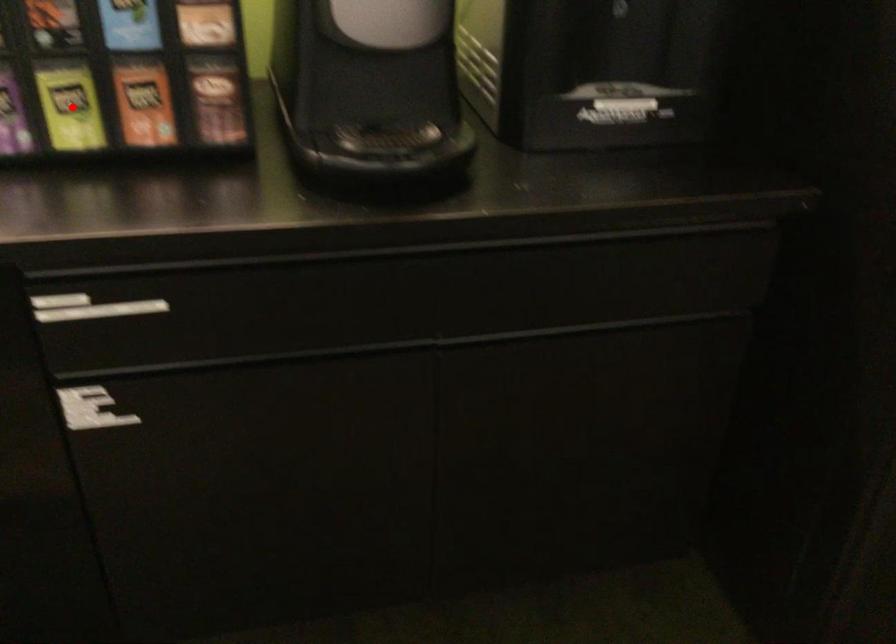
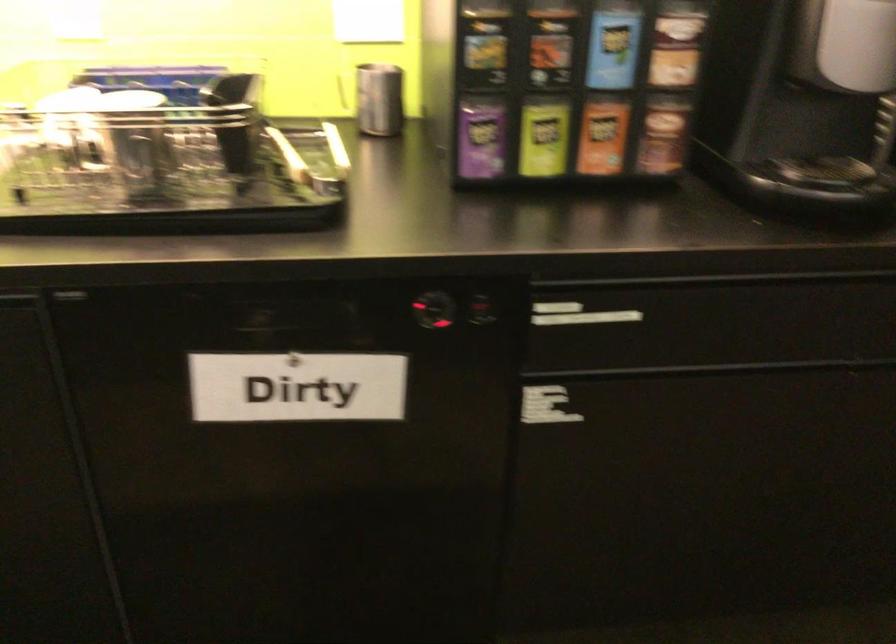
Question: I am providing you with two images of the same scene from different viewpoints. Given a red point in image1, look at the same physical point in image2. Is it:

Choices:
 (A) Closer to the viewpoint
 (B) Farther from the viewpoint

Answer: (B)